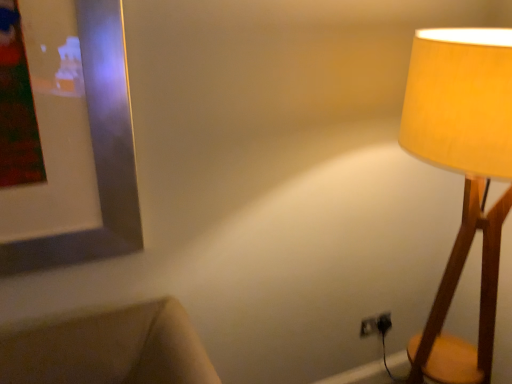
What do you see at coordinates (465, 178) in the screenshot? The height and width of the screenshot is (384, 512). I see `wooden tripod lamp at right` at bounding box center [465, 178].

This screenshot has height=384, width=512. I want to click on wooden tripod lamp at right, so click(x=465, y=178).

Image resolution: width=512 pixels, height=384 pixels. Find the location of `wooden tripod lamp at right`. wooden tripod lamp at right is located at coordinates (465, 178).